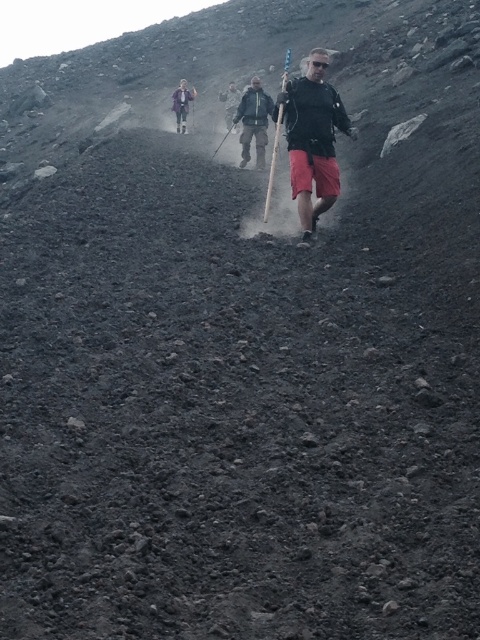
Question: Observing the image, what is the correct spatial positioning of matte black jacket at center in reference to matte gray jacket at upper center?

Choices:
 (A) below
 (B) above

Answer: (A)

Question: Considering the relative positions of matte black jacket at center and dark gray jacket at center in the image provided, where is matte black jacket at center located with respect to dark gray jacket at center?

Choices:
 (A) left
 (B) right

Answer: (B)

Question: Among these points, which one is nearest to the camera?

Choices:
 (A) (315, 177)
 (B) (249, 109)

Answer: (A)

Question: Among these points, which one is farthest from the camera?

Choices:
 (A) (331, 173)
 (B) (178, 93)
 (C) (264, 115)

Answer: (B)

Question: Considering the relative positions of dark gray jacket at center and matte gray jacket at upper center in the image provided, where is dark gray jacket at center located with respect to matte gray jacket at upper center?

Choices:
 (A) above
 (B) below

Answer: (B)

Question: Considering the real-world distances, which object is farthest from the matte black jacket at center?

Choices:
 (A) matte gray jacket at upper center
 (B) dark gray jacket at center

Answer: (A)